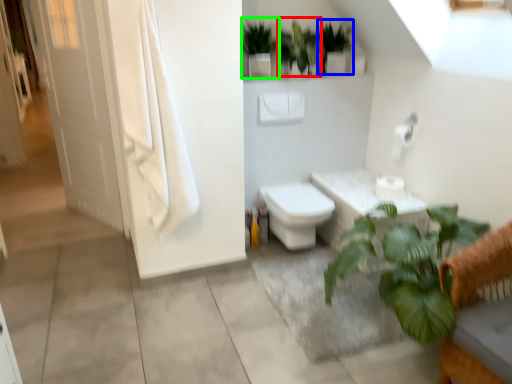
Question: Estimate the real-world distances between objects in this image. Which object is closer to vegetation (highlighted by a red box), vegetation (highlighted by a blue box) or vegetation (highlighted by a green box)?

Choices:
 (A) vegetation
 (B) vegetation

Answer: (A)